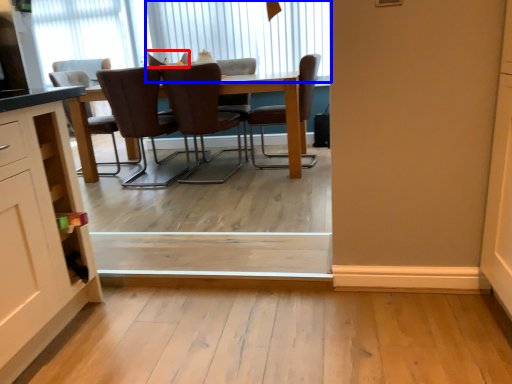
Question: Which object is closer to the camera taking this photo, chair (highlighted by a red box) or window (highlighted by a blue box)?

Choices:
 (A) chair
 (B) window

Answer: (A)